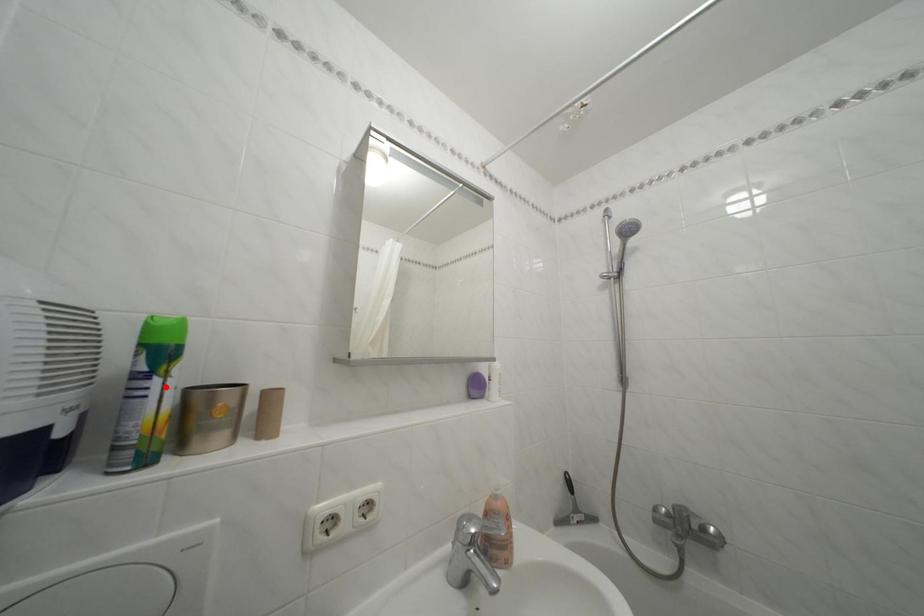
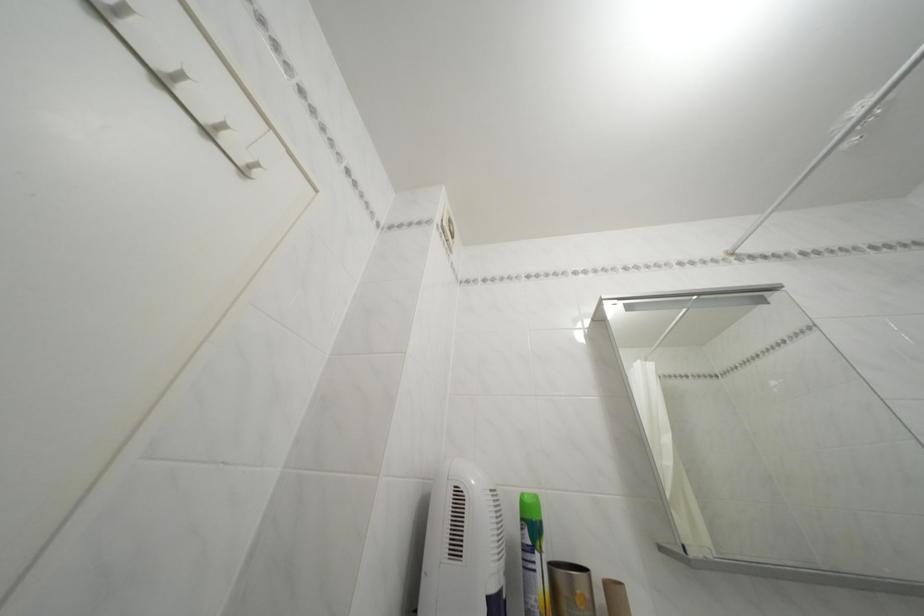
Question: I am providing you with two images of the same scene from different viewpoints. A red point is marked on the first image. Can you still see the location of the red point in image 2?

Choices:
 (A) Yes
 (B) No

Answer: (A)